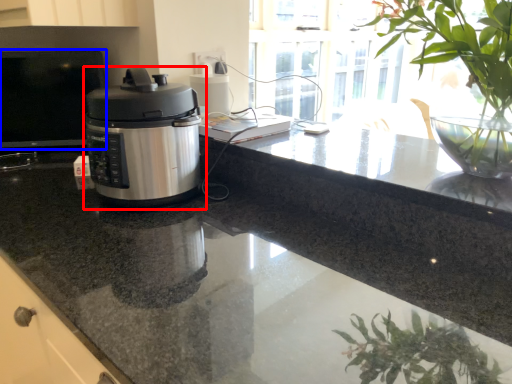
Question: Among these objects, which one is farthest to the camera, home appliance (highlighted by a red box) or desktop (highlighted by a blue box)?

Choices:
 (A) home appliance
 (B) desktop

Answer: (B)